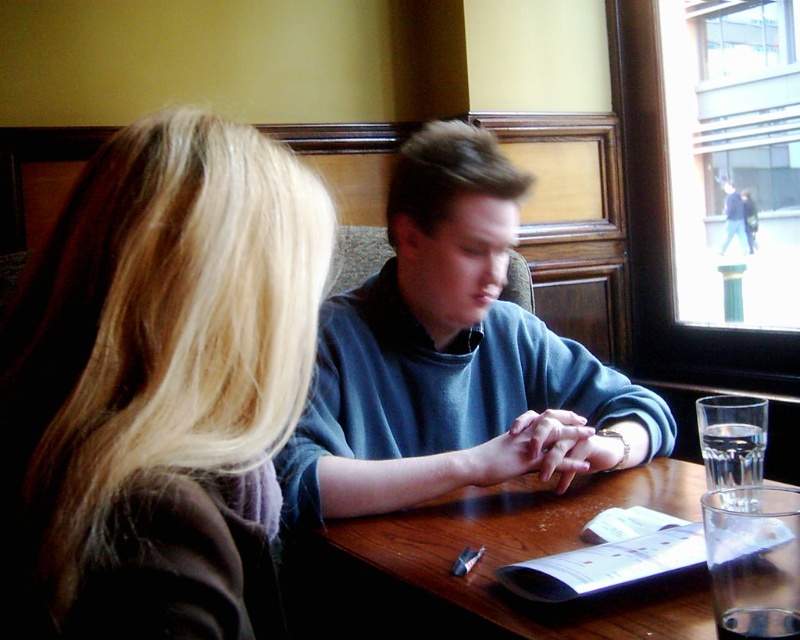
Who is lower down, wooden table at center or matte blue sweater at center?

wooden table at center is below.

Where is `wooden table at center`? The width and height of the screenshot is (800, 640). wooden table at center is located at coordinates (537, 550).

Does point (202, 611) come behind point (402, 157)?

No, (202, 611) is closer to viewer.

Find the location of a particular element. The width and height of the screenshot is (800, 640). blonde hair at upper left is located at coordinates (158, 387).

What do you see at coordinates (158, 387) in the screenshot?
I see `blonde hair at upper left` at bounding box center [158, 387].

This screenshot has height=640, width=800. I want to click on blonde hair at upper left, so click(x=158, y=387).

Find the location of `blue cotton shirt at center`. blue cotton shirt at center is located at coordinates (452, 356).

Between blue cotton shirt at center and wooden table at center, which one has more height?

Standing taller between the two is blue cotton shirt at center.

Who is more distant from viewer, (288, 445) or (521, 512)?

Point (288, 445)

Find the location of `blue cotton shirt at center`. blue cotton shirt at center is located at coordinates click(x=452, y=356).